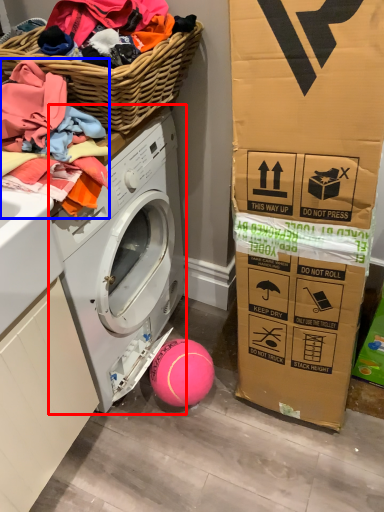
Question: Among these objects, which one is nearest to the camera, washing machine (highlighted by a red box) or clothing (highlighted by a blue box)?

Choices:
 (A) washing machine
 (B) clothing

Answer: (B)